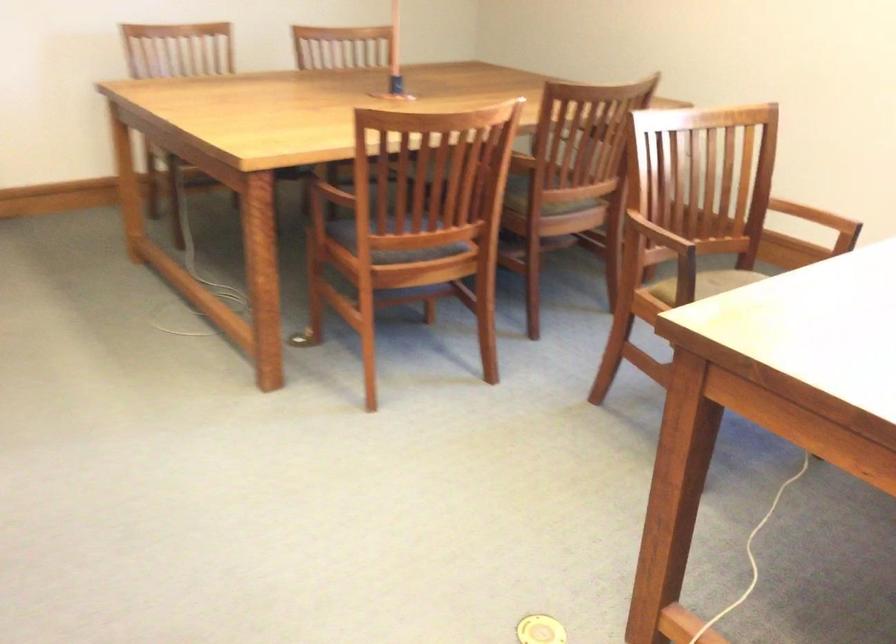
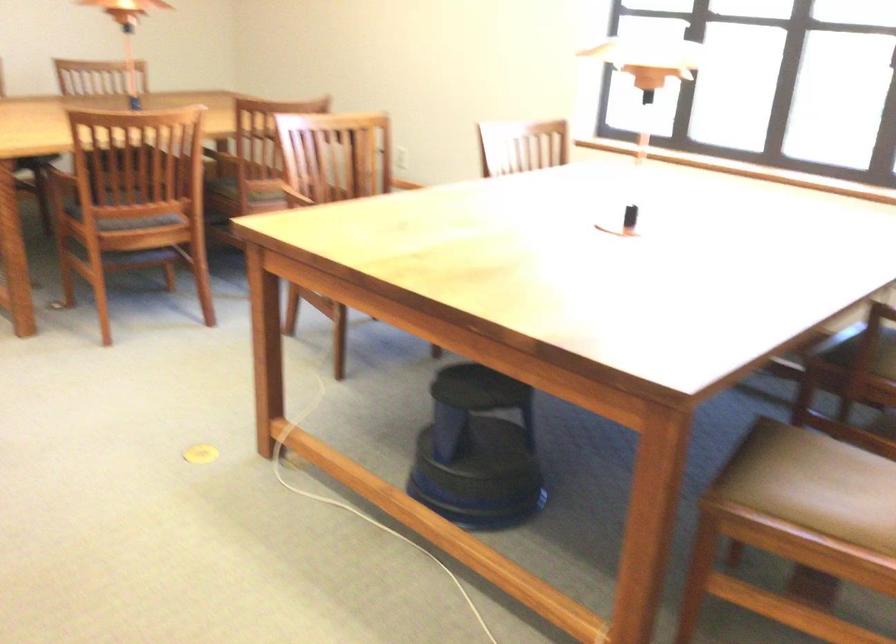
Locate, in the second image, the point that corresponds to (x=635, y=223) in the first image.

(303, 194)